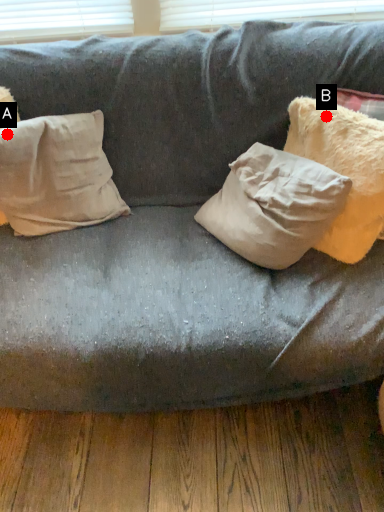
Question: Two points are circled on the image, labeled by A and B beside each circle. Among these points, which one is farthest from the camera?

Choices:
 (A) A is further
 (B) B is further

Answer: (A)